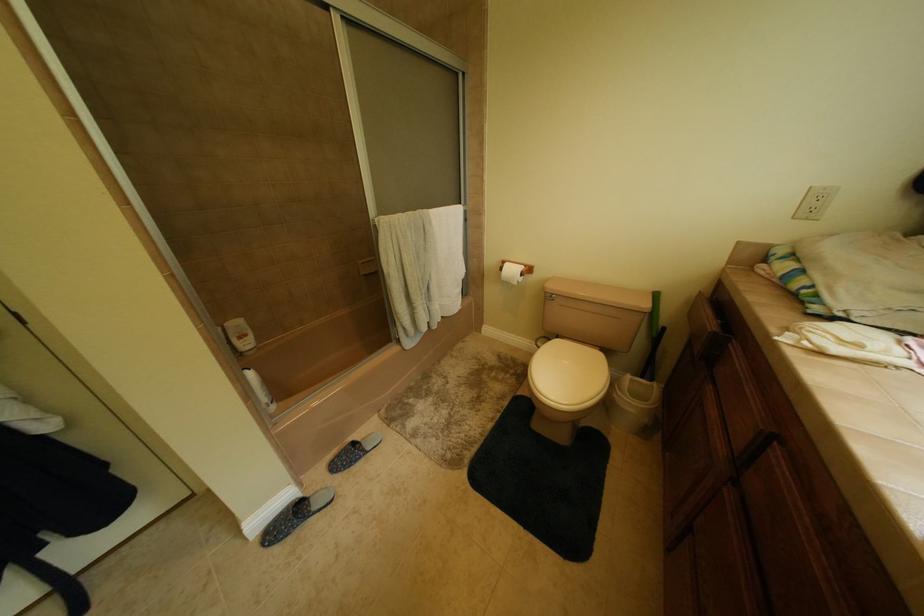
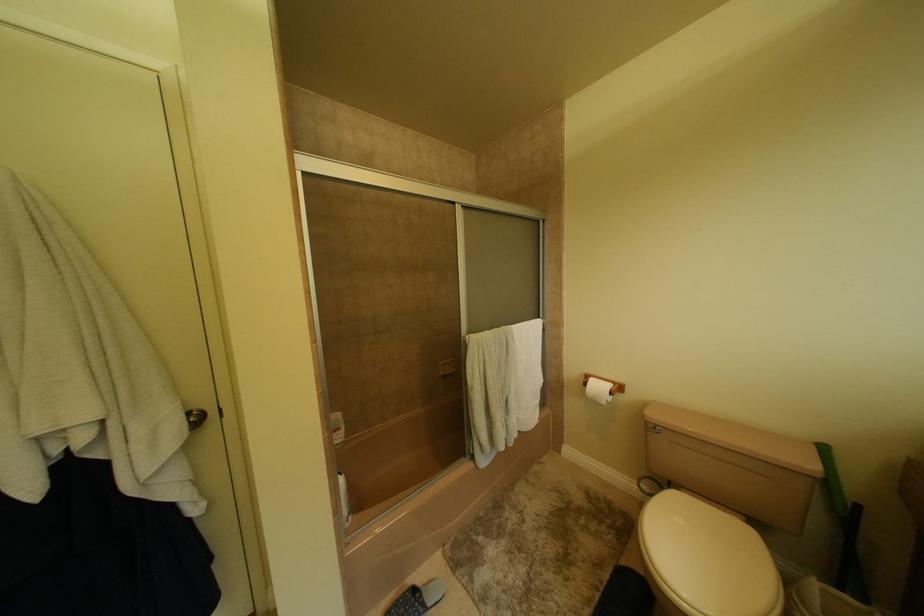
The first image is from the beginning of the video and the second image is from the end. How did the camera likely rotate when shooting the video?

The camera rotated toward left-up.